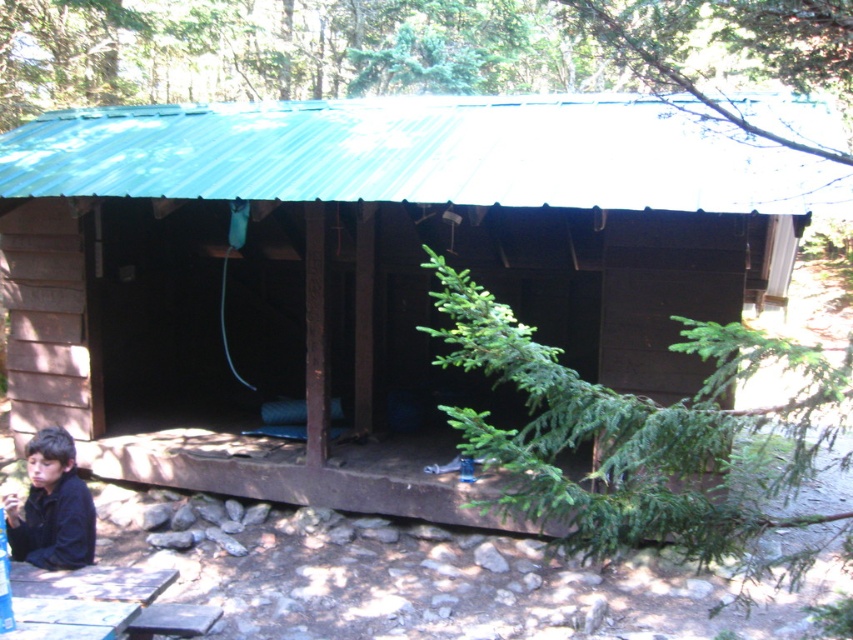
Question: Does green corrugated metal cabin at center appear over black matte jacket at lower left?

Choices:
 (A) yes
 (B) no

Answer: (A)

Question: Can you confirm if wooden picnic table at lower left is smaller than black matte jacket at lower left?

Choices:
 (A) no
 (B) yes

Answer: (A)

Question: Which point is closer to the camera taking this photo?

Choices:
 (A) (44, 499)
 (B) (724, 282)

Answer: (A)

Question: In this image, where is green corrugated metal cabin at center located relative to wooden picnic table at lower left?

Choices:
 (A) right
 (B) left

Answer: (B)

Question: Based on their relative distances, which object is farther from the black matte jacket at lower left?

Choices:
 (A) wooden picnic table at lower left
 (B) green corrugated metal cabin at center

Answer: (B)

Question: Which point is closer to the camera taking this photo?

Choices:
 (A) [64, 576]
 (B) [154, 394]

Answer: (A)